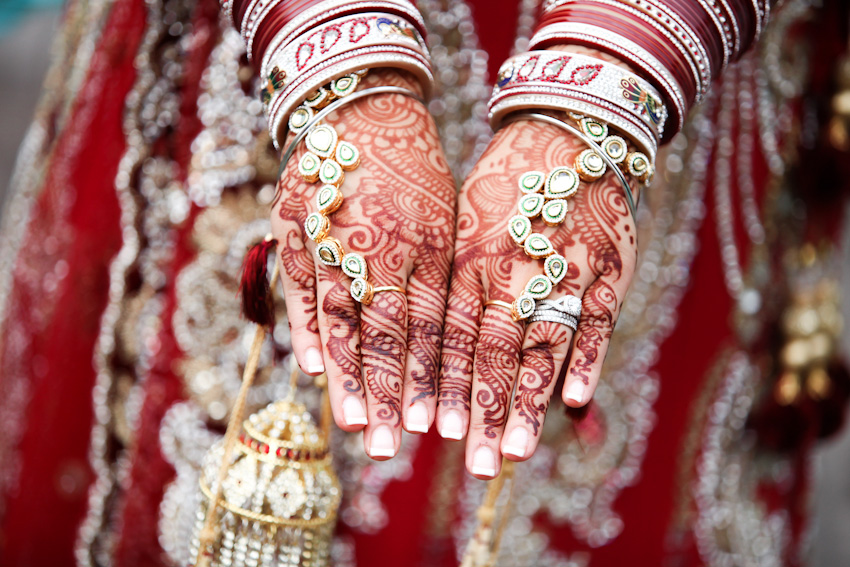
The height and width of the screenshot is (567, 850). I want to click on red cloth, so click(x=680, y=365).